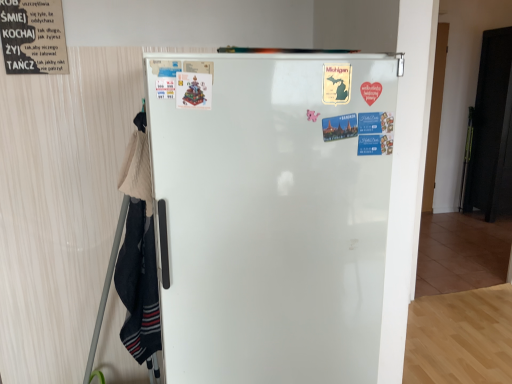
Question: From a real-world perspective, relative to white glossy refrigerator at center, is black paper poster at upper left, which is the first poster in left-to-right order, vertically above or below?

Choices:
 (A) below
 (B) above

Answer: (B)

Question: Is black paper poster at upper left, positioned as the second poster in front-to-back order, to the left or to the right of white glossy refrigerator at center in the image?

Choices:
 (A) left
 (B) right

Answer: (A)

Question: Estimate the real-world distances between objects in this image. Which object is closer to the white glossy refrigerator at center?

Choices:
 (A) black paper poster at upper left, arranged as the first poster when viewed from the top
 (B) matte plastic poster at center, which is the 2th poster in back-to-front order
 (C) black matte door at right

Answer: (B)

Question: Which object is positioned farthest from the black matte door at right?

Choices:
 (A) white glossy refrigerator at center
 (B) black paper poster at upper left, the 1th poster in the back-to-front sequence
 (C) matte plastic poster at center, arranged as the 1th poster when viewed from the right

Answer: (C)